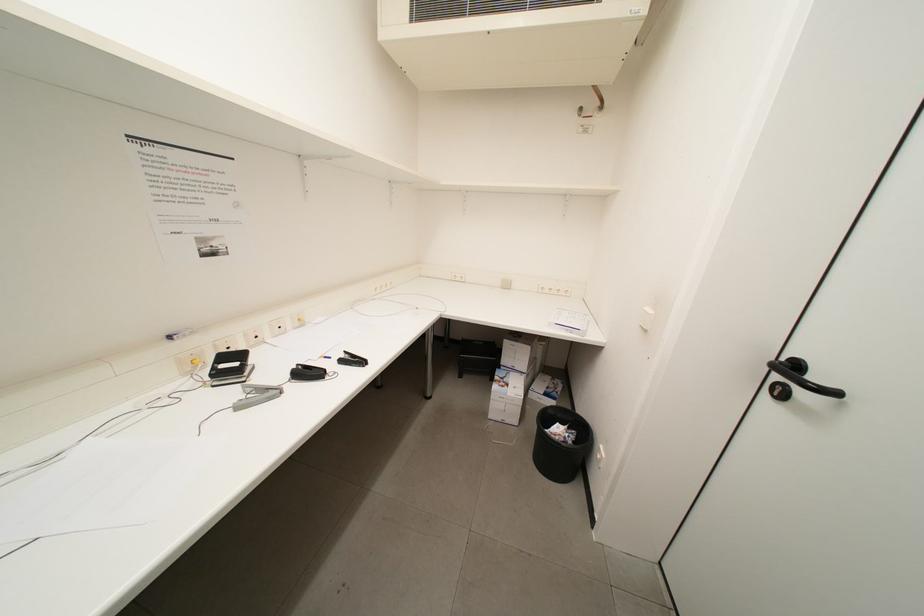
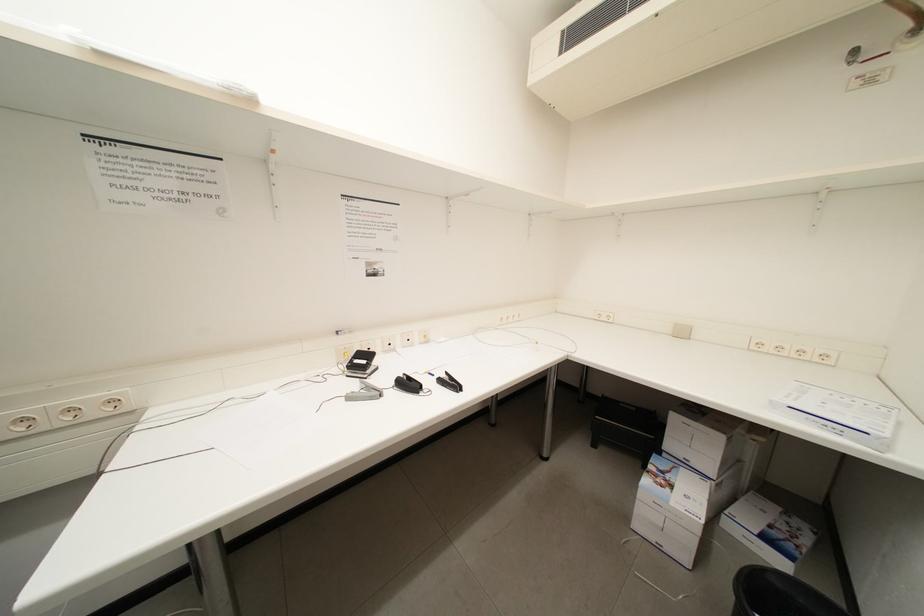
Question: The images are taken continuously from a first-person perspective. In which direction is your viewpoint rotating?

Choices:
 (A) Left
 (B) Right
 (C) Up
 (D) Down

Answer: (A)